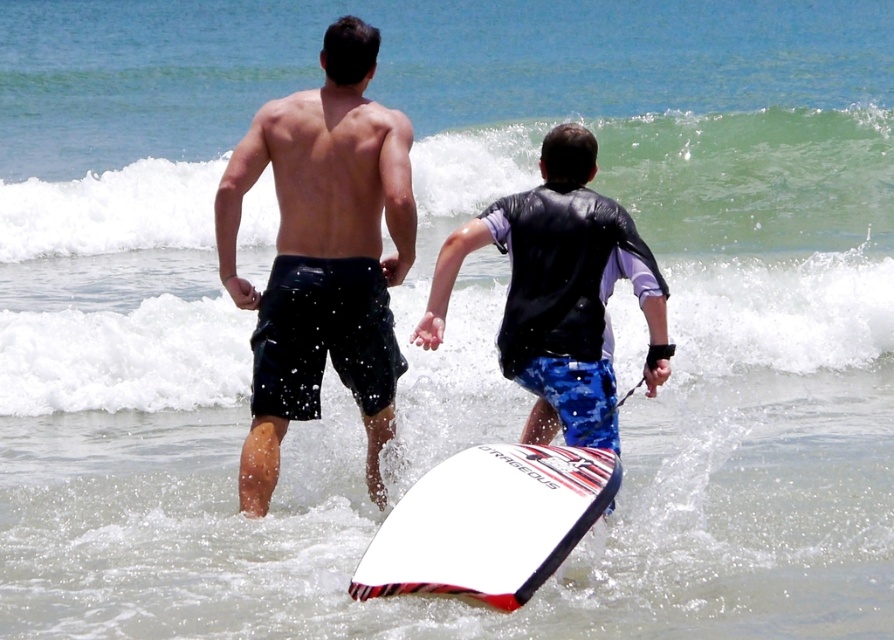
Question: Does blue camouflage shorts at center appear on the right side of white matte surfboard at center?

Choices:
 (A) no
 (B) yes

Answer: (B)

Question: Which point appears closest to the camera in this image?

Choices:
 (A) (591, 136)
 (B) (432, 556)
 (C) (316, 321)

Answer: (B)

Question: Does green frothy wave at upper center appear on the left side of black matte shorts at center?

Choices:
 (A) yes
 (B) no

Answer: (B)

Question: Can you confirm if black matte shorts at center is smaller than blue camouflage shorts at center?

Choices:
 (A) no
 (B) yes

Answer: (B)

Question: Estimate the real-world distances between objects in this image. Which object is farther from the white matte surfboard at center?

Choices:
 (A) black matte shorts at center
 (B) green frothy wave at upper center

Answer: (B)

Question: Among these points, which one is nearest to the camera?

Choices:
 (A) (793, 145)
 (B) (242, 289)
 (C) (521, 208)
 (D) (462, 520)

Answer: (D)